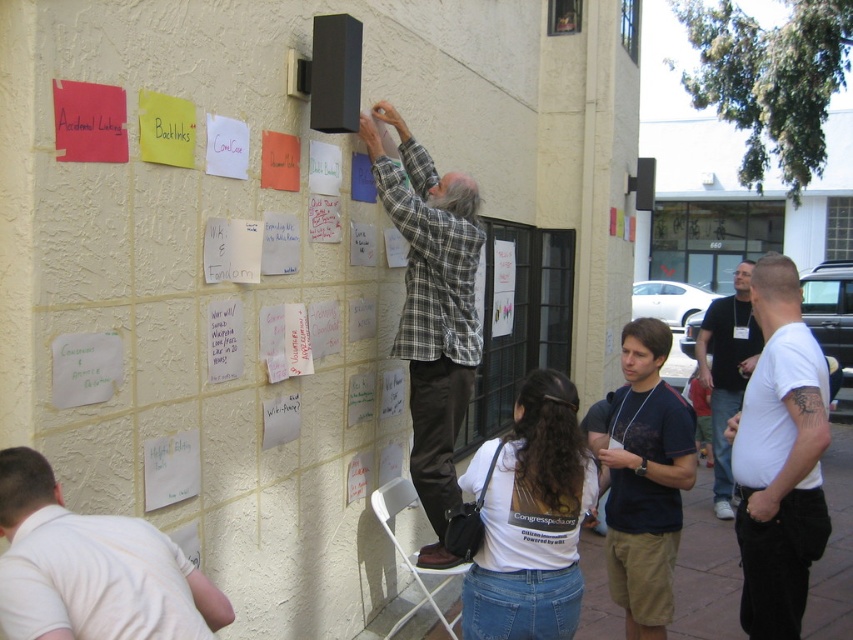
Question: Is white cotton t-shirt at right closer to camera compared to white t-shirt at right?

Choices:
 (A) no
 (B) yes

Answer: (B)

Question: Which of the following is the farthest from the observer?

Choices:
 (A) plaid flannel shirt at center
 (B) white t-shirt at right
 (C) white cotton t-shirt at right

Answer: (B)

Question: Is white matte shirt at lower left positioned behind white t-shirt at right?

Choices:
 (A) no
 (B) yes

Answer: (A)

Question: Which of the following is the farthest from the observer?

Choices:
 (A) white matte shirt at lower left
 (B) white t-shirt at right
 (C) dark blue t-shirt at center

Answer: (B)

Question: Which object appears farthest from the camera in this image?

Choices:
 (A) white matte shirt at lower left
 (B) white cotton t-shirt at right
 (C) white t-shirt at right
 (D) dark blue t-shirt at center

Answer: (C)

Question: Does white matte shirt at lower left lie behind white cotton t-shirt at right?

Choices:
 (A) no
 (B) yes

Answer: (A)